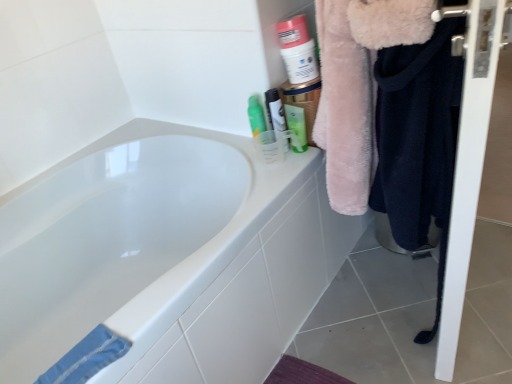
What do you see at coordinates (296, 125) in the screenshot?
I see `green matte tube at upper right, marked as the 1th mouthwash in a right-to-left arrangement` at bounding box center [296, 125].

Locate an element on the screen. This screenshot has width=512, height=384. faded denim towel at lower left is located at coordinates (87, 357).

You are a GUI agent. You are given a task and a screenshot of the screen. Output one action in this format:
    pyautogui.click(x=<x>, y=<y>)
    Task: Click on the translucent plastic cup at upper right, arranged as the 1th mouthwash when viewed from the left
    Image resolution: width=512 pixels, height=384 pixels.
    Given the screenshot: What is the action you would take?
    pyautogui.click(x=275, y=110)

The image size is (512, 384). What do you see at coordinates (468, 157) in the screenshot? I see `white glossy screen door at right` at bounding box center [468, 157].

You are a GUI agent. You are given a task and a screenshot of the screen. Output one action in this format:
    pyautogui.click(x=<x>, y=<y>)
    Task: Click on the white glossy screen door at right
    The image size is (512, 384).
    Given the screenshot: What is the action you would take?
    pyautogui.click(x=468, y=157)

Where is `green matte tube at upper right, marked as the 1th mouthwash in a right-to-left arrangement`? Image resolution: width=512 pixels, height=384 pixels. green matte tube at upper right, marked as the 1th mouthwash in a right-to-left arrangement is located at coordinates (296, 125).

From the image's perspective, would you say faded denim towel at lower left is positioned over green matte tube at upper right, which ranks as the second mouthwash in left-to-right order?

Incorrect, from the image's perspective, faded denim towel at lower left is lower than green matte tube at upper right, which ranks as the second mouthwash in left-to-right order.

Which object is wider, faded denim towel at lower left or green matte tube at upper right, which ranks as the second mouthwash in left-to-right order?

With larger width is faded denim towel at lower left.

Considering the positions of objects faded denim towel at lower left and green matte tube at upper right, marked as the 1th mouthwash in a right-to-left arrangement, in the image provided, who is more to the right, faded denim towel at lower left or green matte tube at upper right, marked as the 1th mouthwash in a right-to-left arrangement,?

green matte tube at upper right, marked as the 1th mouthwash in a right-to-left arrangement.

Which of these two, faded denim towel at lower left or green matte tube at upper right, marked as the 1th mouthwash in a right-to-left arrangement, is smaller?

Smaller between the two is green matte tube at upper right, marked as the 1th mouthwash in a right-to-left arrangement.

Starting from the fuzzy pink coat at right, which mouthwash is the 1st one behind? Please provide its 2D coordinates.

[(275, 110)]

Considering the positions of points (288, 150) and (342, 207), is point (288, 150) closer to camera compared to point (342, 207)?

No, (288, 150) is behind (342, 207).

Between translucent plastic cup at upper right, the 2th mouthwash in the right-to-left sequence, and fuzzy pink coat at right, which one is positioned in front?

fuzzy pink coat at right.

Can you confirm if white glossy screen door at right is positioned to the left of dark blue fleece at right?

In fact, white glossy screen door at right is to the right of dark blue fleece at right.

Consider the image. Which object is thinner, white glossy screen door at right or dark blue fleece at right?

dark blue fleece at right.

Is white glossy screen door at right looking in the opposite direction of dark blue fleece at right?

Yes, white glossy screen door at right is facing away from dark blue fleece at right.

Measure the distance between white glossy screen door at right and dark blue fleece at right.

white glossy screen door at right is 5.40 inches from dark blue fleece at right.

From the image's perspective, which is above, translucent plastic cup at upper right, arranged as the 1th mouthwash when viewed from the left, or matte white container at upper right?

matte white container at upper right.

You are a GUI agent. You are given a task and a screenshot of the screen. Output one action in this format:
    pyautogui.click(x=<x>, y=<y>)
    Task: Click on the cleaning product in front of the translucent plastic cup at upper right, the 2th mouthwash in the right-to-left sequence
    
    Given the screenshot: What is the action you would take?
    pyautogui.click(x=297, y=49)

Between translucent plastic cup at upper right, arranged as the 1th mouthwash when viewed from the left, and matte white container at upper right, which one has larger width?

matte white container at upper right.

Is point (275, 92) farther from viewer compared to point (307, 81)?

No, (275, 92) is closer to viewer.

From the image's perspective, between green matte tube at upper right, which ranks as the second mouthwash in left-to-right order, and fuzzy pink coat at right, who is located below?

fuzzy pink coat at right, from the image's perspective.

Who is bigger, green matte tube at upper right, which ranks as the second mouthwash in left-to-right order, or fuzzy pink coat at right?

Bigger between the two is fuzzy pink coat at right.

Does green matte tube at upper right, which ranks as the second mouthwash in left-to-right order, have a greater height compared to fuzzy pink coat at right?

Incorrect, the height of green matte tube at upper right, which ranks as the second mouthwash in left-to-right order, is not larger of that of fuzzy pink coat at right.

Is green matte tube at upper right, marked as the 1th mouthwash in a right-to-left arrangement, located outside fuzzy pink coat at right?

Indeed, green matte tube at upper right, marked as the 1th mouthwash in a right-to-left arrangement, is completely outside fuzzy pink coat at right.

Is point (8, 304) in front of point (414, 110)?

No.

Is white glossy bathtub at upper left inside the boundaries of dark blue fleece at right, or outside?

white glossy bathtub at upper left exists outside the volume of dark blue fleece at right.

Is white glossy bathtub at upper left next to dark blue fleece at right and touching it?

No, white glossy bathtub at upper left is not making contact with dark blue fleece at right.

From the image's perspective, which is above, white glossy bathtub at upper left or dark blue fleece at right?

dark blue fleece at right, from the image's perspective.

From the picture: Is dark blue fleece at right far away from faded denim towel at lower left?

Actually, dark blue fleece at right and faded denim towel at lower left are a little close together.

Measure the distance between dark blue fleece at right and faded denim towel at lower left.

dark blue fleece at right is 30.17 inches away from faded denim towel at lower left.

Considering the relative sizes of dark blue fleece at right and faded denim towel at lower left in the image provided, is dark blue fleece at right bigger than faded denim towel at lower left?

Indeed, dark blue fleece at right has a larger size compared to faded denim towel at lower left.

Find the location of a particular element. Image resolution: width=512 pixels, height=384 pixels. clothing above the faded denim towel at lower left (from the image's perspective) is located at coordinates (417, 133).

This screenshot has height=384, width=512. Find the location of `bath towel that is in front of the green matte tube at upper right, which ranks as the second mouthwash in left-to-right order`. bath towel that is in front of the green matte tube at upper right, which ranks as the second mouthwash in left-to-right order is located at coordinates point(87,357).

Find the location of a particular element. The image size is (512, 384). fur coat lying on the right of translucent plastic cup at upper right, the 2th mouthwash in the right-to-left sequence is located at coordinates (357, 86).

Looking at the image, which one is located further to translucent plastic cup at upper right, arranged as the 1th mouthwash when viewed from the left, white glossy screen door at right or faded denim towel at lower left?

Based on the image, faded denim towel at lower left appears to be further to translucent plastic cup at upper right, arranged as the 1th mouthwash when viewed from the left.

Based on the photo, considering their positions, is white glossy screen door at right positioned closer to dark blue fleece at right than faded denim towel at lower left?

Based on the image, white glossy screen door at right appears to be nearer to dark blue fleece at right.

Looking at the image, which one is located further to white glossy screen door at right, green matte tube at upper right, which ranks as the second mouthwash in left-to-right order, or faded denim towel at lower left?

faded denim towel at lower left lies further to white glossy screen door at right than the other object.

Estimate the real-world distances between objects in this image. Which object is closer to fuzzy pink coat at right, dark blue fleece at right or green matte tube at upper right, which ranks as the second mouthwash in left-to-right order?

dark blue fleece at right is closer to fuzzy pink coat at right.

When comparing their distances from matte white container at upper right, does translucent plastic cup at upper right, arranged as the 1th mouthwash when viewed from the left, or fuzzy pink coat at right seem closer?

translucent plastic cup at upper right, arranged as the 1th mouthwash when viewed from the left, is positioned closer to the anchor matte white container at upper right.

Considering their positions, is fuzzy pink coat at right positioned further to translucent plastic cup at upper right, the 2th mouthwash in the right-to-left sequence, than white glossy bathtub at upper left?

Among the two, white glossy bathtub at upper left is located further to translucent plastic cup at upper right, the 2th mouthwash in the right-to-left sequence.

When comparing their distances from matte white container at upper right, does dark blue fleece at right or fuzzy pink coat at right seem closer?

fuzzy pink coat at right lies closer to matte white container at upper right than the other object.

Looking at the image, which one is located closer to fuzzy pink coat at right, white glossy bathtub at upper left or green matte tube at upper right, marked as the 1th mouthwash in a right-to-left arrangement?

green matte tube at upper right, marked as the 1th mouthwash in a right-to-left arrangement, is positioned closer to the anchor fuzzy pink coat at right.

At what (x,y) coordinates should I click in order to perform the action: click on cleaning product positioned between white glossy screen door at right and translucent plastic cup at upper right, the 2th mouthwash in the right-to-left sequence, from near to far. Please return your answer as a coordinate pair (x, y). Looking at the image, I should click on (297, 49).

This screenshot has height=384, width=512. I want to click on bathtub located between faded denim towel at lower left and green matte tube at upper right, which ranks as the second mouthwash in left-to-right order, in the depth direction, so click(164, 257).

I want to click on bath towel between white glossy bathtub at upper left and dark blue fleece at right, so click(x=87, y=357).

Locate an element on the screen. This screenshot has height=384, width=512. mouthwash between dark blue fleece at right and green matte tube at upper right, marked as the 1th mouthwash in a right-to-left arrangement, from front to back is located at coordinates (275, 110).